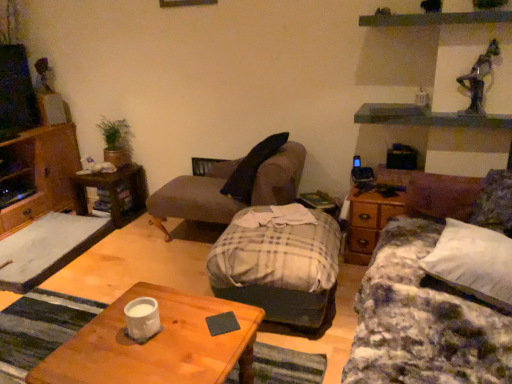
Find the location of a particular element. The image size is (512, 384). vacant space situated above wooden coffee table at center (from a real-world perspective) is located at coordinates (145, 348).